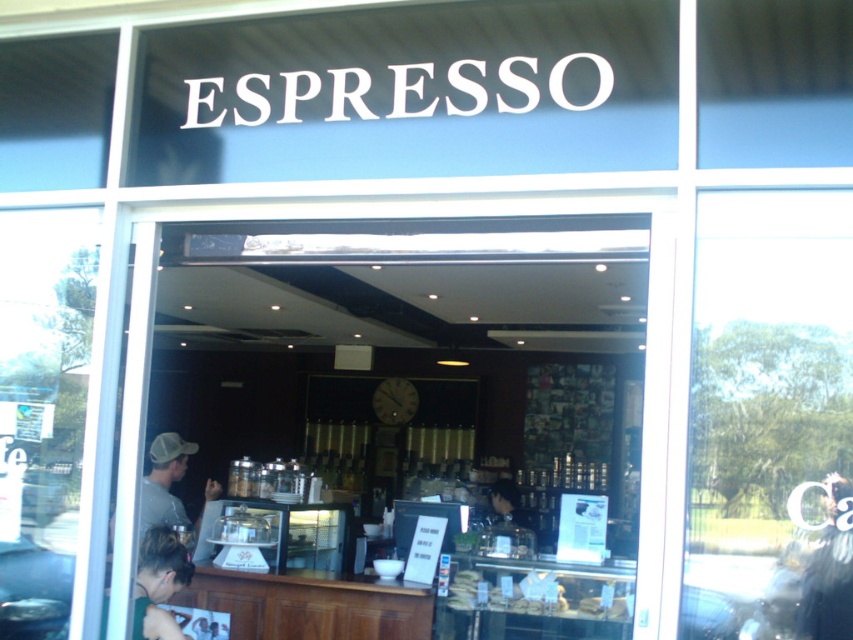
Question: Is wooden counter at center below transparent glass window at center?

Choices:
 (A) yes
 (B) no

Answer: (A)

Question: Estimate the real-world distances between objects in this image. Which object is closer to the transparent glass window at center?

Choices:
 (A) blonde hair at lower left
 (B) translucent glass bread at center
 (C) wooden counter at center

Answer: (B)

Question: Is wooden counter at center below transparent glass window at center?

Choices:
 (A) yes
 (B) no

Answer: (A)

Question: Which point is closer to the camera taking this photo?

Choices:
 (A) (490, 602)
 (B) (171, 580)

Answer: (B)

Question: Can you confirm if wooden counter at center is wider than translucent glass bread at center?

Choices:
 (A) yes
 (B) no

Answer: (A)

Question: Among these objects, which one is nearest to the camera?

Choices:
 (A) blonde hair at lower left
 (B) transparent glass window at center

Answer: (B)